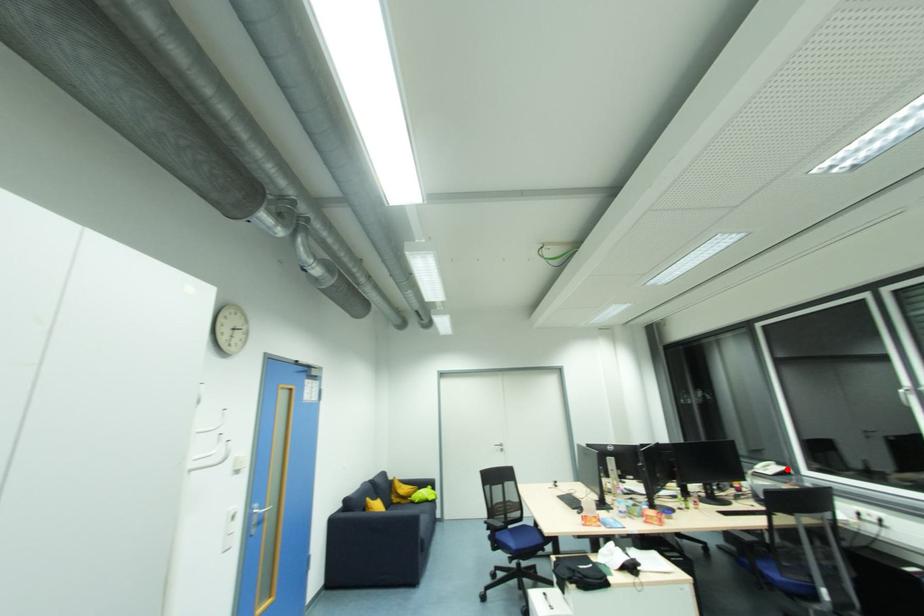
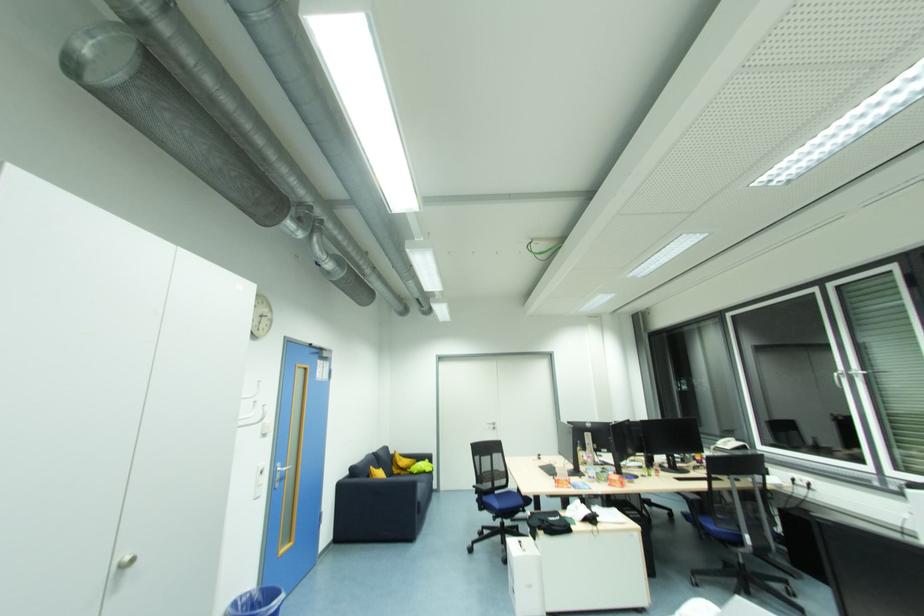
Question: I am providing you with two images of the same scene from different viewpoints. A red point is shown in image1. For the corresponding object point in image2, is it positioned nearer or farther from the camera?

Choices:
 (A) Nearer
 (B) Farther

Answer: (A)